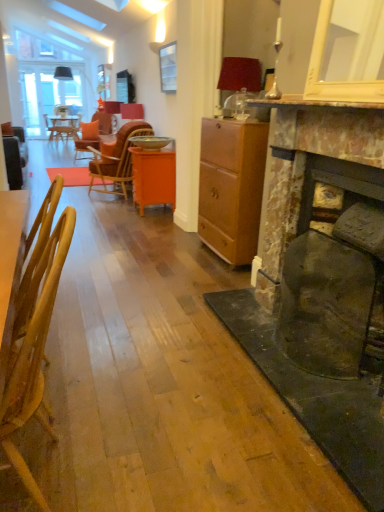
Question: Is wooden chair at left, which is the first chair in bottom-to-top order, positioned before orange glossy cabinet at center?

Choices:
 (A) yes
 (B) no

Answer: (A)

Question: Can you confirm if wooden chair at left, the second chair from the top, is taller than orange glossy cabinet at center?

Choices:
 (A) no
 (B) yes

Answer: (B)

Question: Does wooden chair at left, which is the first chair in bottom-to-top order, have a lesser width compared to orange glossy cabinet at center?

Choices:
 (A) yes
 (B) no

Answer: (A)

Question: Is wooden chair at left, the first chair when ordered from front to back, outside of orange glossy cabinet at center?

Choices:
 (A) yes
 (B) no

Answer: (A)

Question: Does wooden chair at left, the second chair from the top, have a larger size compared to orange glossy cabinet at center?

Choices:
 (A) yes
 (B) no

Answer: (B)

Question: Is wooden chair at left, which is the first chair in bottom-to-top order, further to camera compared to orange glossy cabinet at center?

Choices:
 (A) yes
 (B) no

Answer: (B)

Question: From a real-world perspective, is matte orange lampshade at upper center, which is the first lamp from top to bottom, positioned over rusty stone fireplace at right based on gravity?

Choices:
 (A) yes
 (B) no

Answer: (A)

Question: Can you confirm if matte orange lampshade at upper center, arranged as the second lamp when ordered from the bottom, is shorter than rusty stone fireplace at right?

Choices:
 (A) yes
 (B) no

Answer: (A)

Question: From a real-world perspective, is matte orange lampshade at upper center, which is the first lamp from top to bottom, located beneath rusty stone fireplace at right?

Choices:
 (A) no
 (B) yes

Answer: (A)

Question: Can you confirm if matte orange lampshade at upper center, which ranks as the 1th lamp in left-to-right order, is wider than rusty stone fireplace at right?

Choices:
 (A) yes
 (B) no

Answer: (B)

Question: Is matte orange lampshade at upper center, which is the first lamp from top to bottom, turned away from rusty stone fireplace at right?

Choices:
 (A) no
 (B) yes

Answer: (A)

Question: Is metallic gold bowl at center closer to the viewer compared to matte brown cabinet at center?

Choices:
 (A) yes
 (B) no

Answer: (B)